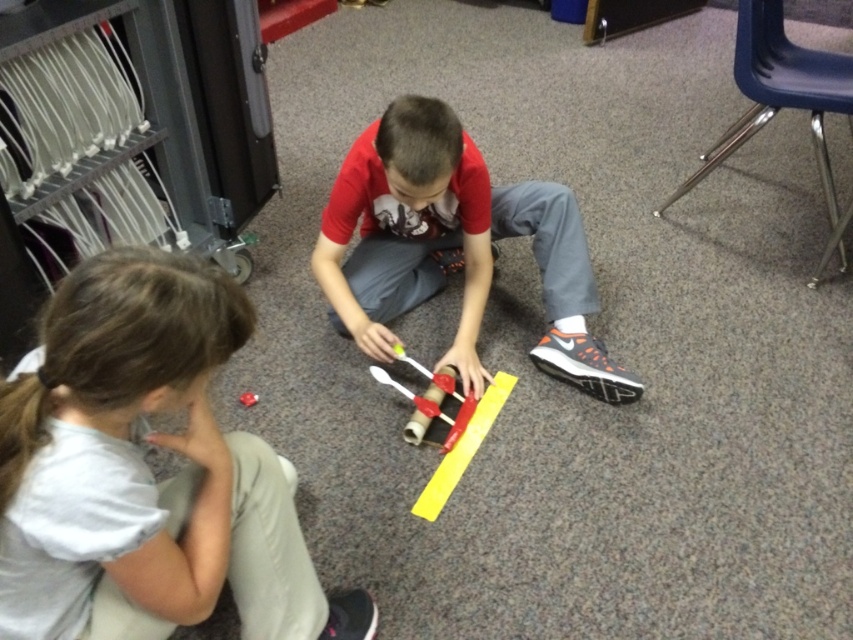
Looking at this image, is white matte shirt at lower left below matte red shirt at center?

Correct, white matte shirt at lower left is located below matte red shirt at center.

Which of these two, white matte shirt at lower left or matte red shirt at center, stands shorter?

Standing shorter between the two is white matte shirt at lower left.

The height and width of the screenshot is (640, 853). In order to click on white matte shirt at lower left in this screenshot , I will do `click(148, 472)`.